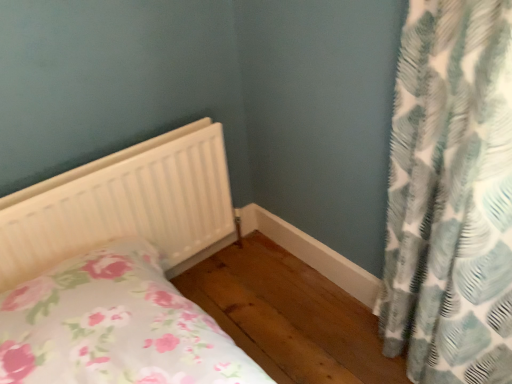
In order to face white matte radiator at lower left, should I rotate leftwards or rightwards?

It's best to rotate left around 15.862 degrees.

Identify the location of white matte radiator at lower left. (119, 270).

What do you see at coordinates (119, 270) in the screenshot? Image resolution: width=512 pixels, height=384 pixels. I see `white matte radiator at lower left` at bounding box center [119, 270].

Locate an element on the screen. This screenshot has width=512, height=384. teal and white patterned curtain at right is located at coordinates click(451, 196).

Image resolution: width=512 pixels, height=384 pixels. What do you see at coordinates (451, 196) in the screenshot?
I see `teal and white patterned curtain at right` at bounding box center [451, 196].

The image size is (512, 384). Identify the location of white matte radiator at lower left. (119, 270).

Considering the relative positions of white matte radiator at lower left and teal and white patterned curtain at right in the image provided, is white matte radiator at lower left to the left or to the right of teal and white patterned curtain at right?

Based on their positions, white matte radiator at lower left is located to the left of teal and white patterned curtain at right.

Does white matte radiator at lower left come behind teal and white patterned curtain at right?

Yes, white matte radiator at lower left is behind teal and white patterned curtain at right.

Which is closer, (140, 373) or (451, 16)?

Positioned in front is point (451, 16).

From the image's perspective, which one is positioned lower, white matte radiator at lower left or teal and white patterned curtain at right?

teal and white patterned curtain at right is shown below in the image.

From a real-world perspective, is white matte radiator at lower left beneath teal and white patterned curtain at right?

Yes, from a real-world perspective, white matte radiator at lower left is below teal and white patterned curtain at right.

Which of these two, white matte radiator at lower left or teal and white patterned curtain at right, is wider?

teal and white patterned curtain at right is wider.

Can you confirm if white matte radiator at lower left is taller than teal and white patterned curtain at right?

No.

Considering the relative sizes of white matte radiator at lower left and teal and white patterned curtain at right in the image provided, is white matte radiator at lower left smaller than teal and white patterned curtain at right?

Indeed, white matte radiator at lower left has a smaller size compared to teal and white patterned curtain at right.

Is white matte radiator at lower left not within teal and white patterned curtain at right?

white matte radiator at lower left lies outside teal and white patterned curtain at right's area.

Is white matte radiator at lower left touching teal and white patterned curtain at right?

white matte radiator at lower left and teal and white patterned curtain at right are clearly separated.

Could you tell me if white matte radiator at lower left is turned towards teal and white patterned curtain at right?

Yes, white matte radiator at lower left is turned towards teal and white patterned curtain at right.

From the picture: Could you measure the distance between white matte radiator at lower left and teal and white patterned curtain at right?

white matte radiator at lower left is 29.37 inches from teal and white patterned curtain at right.

The image size is (512, 384). What are the coordinates of `curtain below the white matte radiator at lower left (from the image's perspective)` in the screenshot? It's located at (451, 196).

Which is more to the left, teal and white patterned curtain at right or white matte radiator at lower left?

white matte radiator at lower left.

Is the depth of teal and white patterned curtain at right greater than that of white matte radiator at lower left?

No, it is in front of white matte radiator at lower left.

Considering the points (417, 178) and (217, 152), which point is behind, point (417, 178) or point (217, 152)?

The point (217, 152) is farther.

From the image's perspective, is teal and white patterned curtain at right located above or below white matte radiator at lower left?

teal and white patterned curtain at right is situated lower than white matte radiator at lower left in the image.

Consider the image. From a real-world perspective, is teal and white patterned curtain at right positioned under white matte radiator at lower left based on gravity?

No, from a real-world perspective, teal and white patterned curtain at right is not below white matte radiator at lower left.

Consider the image. Which of these two, teal and white patterned curtain at right or white matte radiator at lower left, is wider?

With larger width is teal and white patterned curtain at right.

Is teal and white patterned curtain at right shorter than white matte radiator at lower left?

No, teal and white patterned curtain at right is not shorter than white matte radiator at lower left.

Can you confirm if teal and white patterned curtain at right is bigger than white matte radiator at lower left?

Yes.

Is teal and white patterned curtain at right outside of white matte radiator at lower left?

That's correct, teal and white patterned curtain at right is outside of white matte radiator at lower left.

Would you consider teal and white patterned curtain at right to be distant from white matte radiator at lower left?

Actually, teal and white patterned curtain at right and white matte radiator at lower left are a little close together.

Is teal and white patterned curtain at right facing away from white matte radiator at lower left?

No, teal and white patterned curtain at right is not facing the opposite direction of white matte radiator at lower left.

How many degrees apart are the facing directions of teal and white patterned curtain at right and white matte radiator at lower left?

The angular difference between teal and white patterned curtain at right and white matte radiator at lower left is 87.4 degrees.

Consider the image. How distant is teal and white patterned curtain at right from white matte radiator at lower left?

29.37 inches.

Identify the location of curtain above the white matte radiator at lower left (from a real-world perspective). click(451, 196).

Identify the location of bed located underneath the teal and white patterned curtain at right (from a real-world perspective). (119, 270).

Find the location of a particular element. The width and height of the screenshot is (512, 384). curtain above the white matte radiator at lower left (from a real-world perspective) is located at coordinates (451, 196).